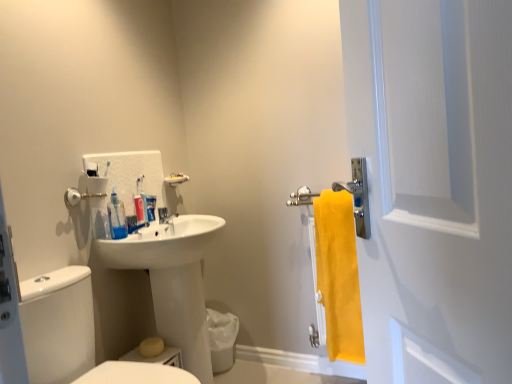
Question: Could you tell me if white glossy sink at center is facing white matte screen door at right?

Choices:
 (A) no
 (B) yes

Answer: (A)

Question: From a real-world perspective, is white glossy sink at center located higher than white matte screen door at right?

Choices:
 (A) yes
 (B) no

Answer: (B)

Question: Does white glossy sink at center appear on the left side of white matte screen door at right?

Choices:
 (A) yes
 (B) no

Answer: (A)

Question: Considering the relative positions of white glossy sink at center and white matte screen door at right in the image provided, is white glossy sink at center behind white matte screen door at right?

Choices:
 (A) no
 (B) yes

Answer: (B)

Question: Is white glossy sink at center not near white matte screen door at right?

Choices:
 (A) no
 (B) yes

Answer: (B)

Question: Considering the positions of white glossy toilet at lower left and white matte toothpaste at center in the image, is white glossy toilet at lower left taller or shorter than white matte toothpaste at center?

Choices:
 (A) tall
 (B) short

Answer: (A)

Question: Is point (48, 273) closer or farther from the camera than point (146, 200)?

Choices:
 (A) closer
 (B) farther

Answer: (A)

Question: From the image's perspective, is white glossy toilet at lower left above or below white matte toothpaste at center?

Choices:
 (A) below
 (B) above

Answer: (A)

Question: In the image, is white glossy toilet at lower left on the left side or the right side of white matte toothpaste at center?

Choices:
 (A) left
 (B) right

Answer: (B)

Question: Based on their sizes in the image, would you say white matte toothpaste at center is bigger or smaller than transparent plastic mouthwash at center?

Choices:
 (A) big
 (B) small

Answer: (B)

Question: Is point (144, 198) closer or farther from the camera than point (109, 221)?

Choices:
 (A) farther
 (B) closer

Answer: (A)

Question: From the image's perspective, is white matte toothpaste at center above or below transparent plastic mouthwash at center?

Choices:
 (A) below
 (B) above

Answer: (B)

Question: Looking at their shapes, would you say white matte toothpaste at center is wider or thinner than transparent plastic mouthwash at center?

Choices:
 (A) thin
 (B) wide

Answer: (A)

Question: From the image's perspective, relative to satin nickel faucet at sink left, is white matte toothpaste at center above or below?

Choices:
 (A) above
 (B) below

Answer: (A)

Question: In the image, is white matte toothpaste at center positioned in front of or behind satin nickel faucet at sink left?

Choices:
 (A) front
 (B) behind

Answer: (A)